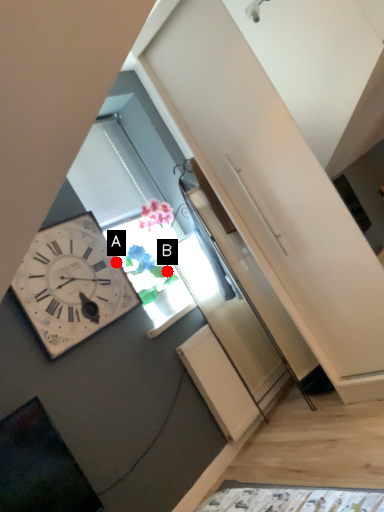
Question: Two points are circled on the image, labeled by A and B beside each circle. Which point appears closest to the camera in this image?

Choices:
 (A) A is closer
 (B) B is closer

Answer: (A)